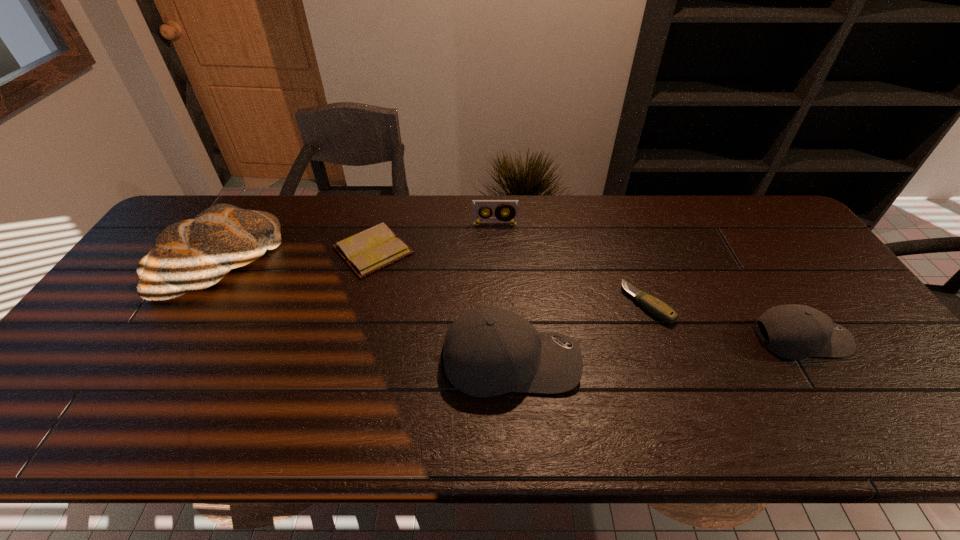
The image size is (960, 540). What are the coordinates of `free space that satisfies the following two spatial constraints: 1. at the front of the videotape with visible reels; 2. on the right side of the pocketknife` in the screenshot? It's located at (498, 304).

At what (x,y) coordinates should I click in order to perform the action: click on free space that satisfies the following two spatial constraints: 1. on the front side of the fifth object from right to left; 2. on the left side of the second shortest object. Please return your answer as a coordinate pair (x, y). The width and height of the screenshot is (960, 540). Looking at the image, I should click on (359, 304).